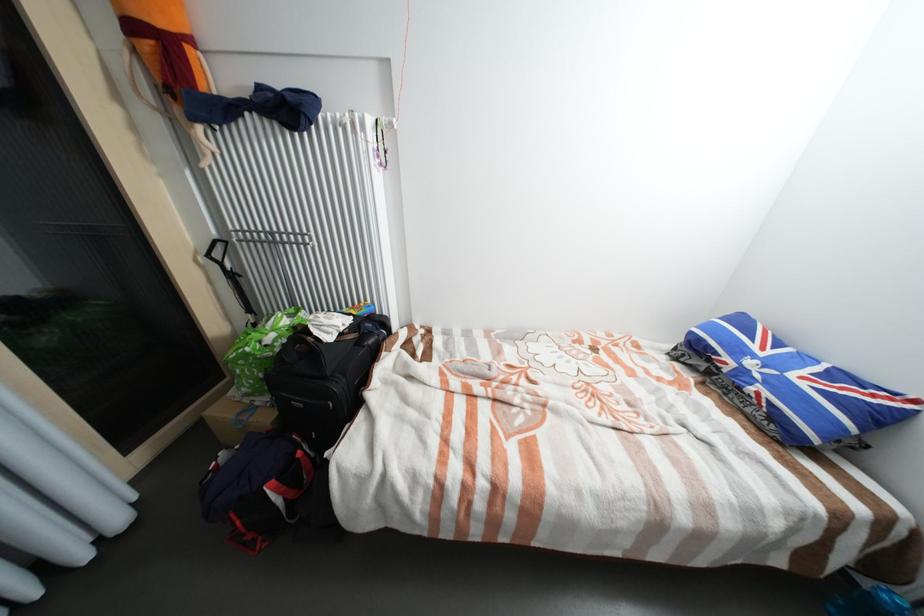
The location [791,386] corresponds to which object?

It corresponds to the Union Jack pillow in the image.